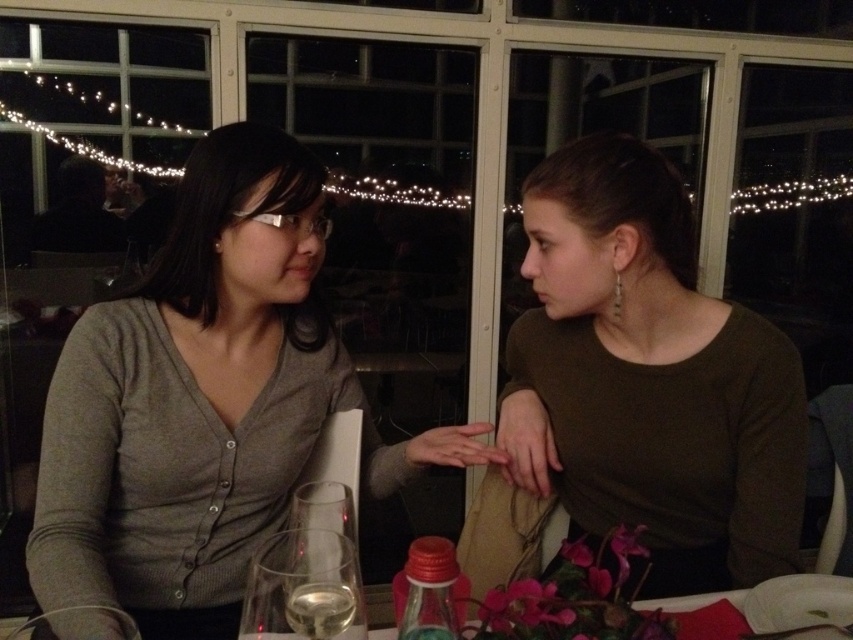
What are the coordinates of the matte brown shirt at center?

The coordinates of the matte brown shirt at center are at point (648, 378).

Consider the image. You are a photographer trying to capture a candid shot of both the matte gray cardigan at left and the matte brown shirt at center. Since you want to include both subjects in the frame, which direction should you position your camera relative to the two people?

Since the matte gray cardigan at left is to the left of the matte brown shirt at center, you should position your camera to the right side of the two people to include both subjects in the frame.

You are a photographer taking a picture of the scene. You want to focus on the matte gray cardigan at left and the clear glass wine glass at lower left. Which object should you adjust your camera focus on first if you want to ensure both are in focus?

The matte gray cardigan at left is further to the viewer than the clear glass wine glass at lower left, so you should focus on the matte gray cardigan at left first to ensure both are in focus.